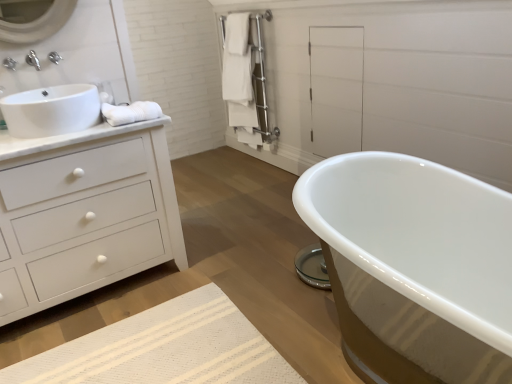
Question: Considering the relative positions of satin nickel towel rack at upper center and white glossy sink at left in the image provided, is satin nickel towel rack at upper center in front of white glossy sink at left?

Choices:
 (A) yes
 (B) no

Answer: (B)

Question: Is satin nickel towel rack at upper center to the right of white glossy sink at left from the viewer's perspective?

Choices:
 (A) yes
 (B) no

Answer: (A)

Question: From the image's perspective, is satin nickel towel rack at upper center below white glossy sink at left?

Choices:
 (A) no
 (B) yes

Answer: (A)

Question: Is satin nickel towel rack at upper center thinner than white glossy sink at left?

Choices:
 (A) no
 (B) yes

Answer: (B)

Question: From a real-world perspective, is satin nickel towel rack at upper center located higher than white glossy sink at left?

Choices:
 (A) no
 (B) yes

Answer: (A)

Question: From the image's perspective, is white matte chest of drawers at left above or below white glossy sink at left?

Choices:
 (A) below
 (B) above

Answer: (A)

Question: In terms of height, does white matte chest of drawers at left look taller or shorter compared to white glossy sink at left?

Choices:
 (A) tall
 (B) short

Answer: (A)

Question: In terms of size, does white matte chest of drawers at left appear bigger or smaller than white glossy sink at left?

Choices:
 (A) small
 (B) big

Answer: (B)

Question: Considering their positions, is white matte chest of drawers at left located in front of or behind white glossy sink at left?

Choices:
 (A) behind
 (B) front

Answer: (B)

Question: Is brushed metal faucet at upper left bigger or smaller than white matte chest of drawers at left?

Choices:
 (A) big
 (B) small

Answer: (B)

Question: Would you say brushed metal faucet at upper left is inside or outside white matte chest of drawers at left?

Choices:
 (A) inside
 (B) outside

Answer: (B)

Question: Would you say brushed metal faucet at upper left is to the left or to the right of white matte chest of drawers at left in the picture?

Choices:
 (A) right
 (B) left

Answer: (B)

Question: Does point 26,61 appear closer or farther from the camera than point 44,240?

Choices:
 (A) closer
 (B) farther

Answer: (B)

Question: In the image, is white towel at left on the left side or the right side of brushed metal faucet at upper left, which is the 1th faucet from front to back?

Choices:
 (A) right
 (B) left

Answer: (A)

Question: From a real-world perspective, is white towel at left physically located above or below brushed metal faucet at upper left, the 2th faucet viewed from the back?

Choices:
 (A) below
 (B) above

Answer: (A)